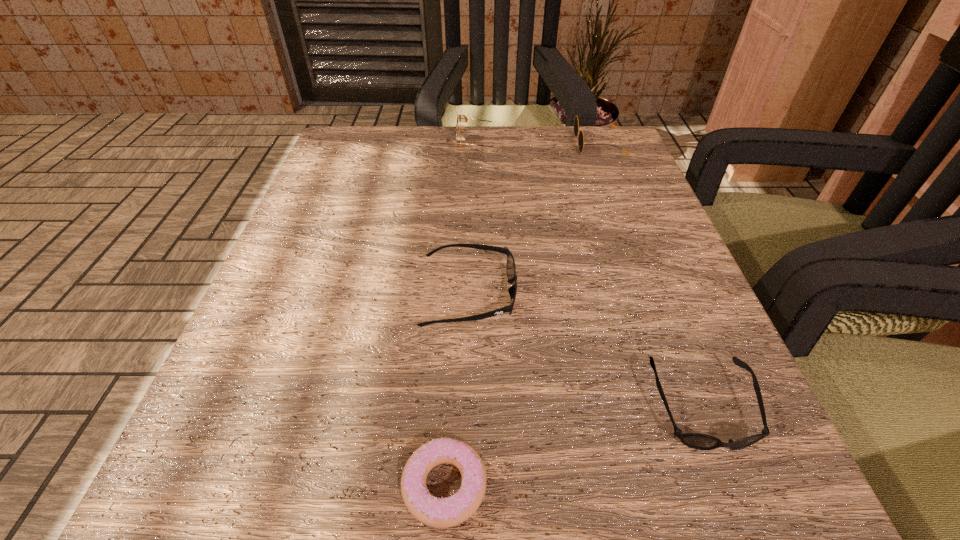
This screenshot has width=960, height=540. In order to click on the tallest object in this screenshot , I will do `click(462, 120)`.

Where is `the third farthest object`? the third farthest object is located at coordinates (510, 267).

At what (x,y) coordinates should I click in order to perform the action: click on the nearest sunglasses. Please return your answer as a coordinate pair (x, y). The width and height of the screenshot is (960, 540). Looking at the image, I should click on 697,441.

Image resolution: width=960 pixels, height=540 pixels. I want to click on doughnut, so click(x=436, y=512).

Locate an element on the screen. free space located 0.090m on the front lenses of the tallest object is located at coordinates (417, 146).

The height and width of the screenshot is (540, 960). I want to click on free region located on the front lenses of the tallest object, so click(356, 146).

Where is `free space located 0.230m on the front lenses of the tallest object`? This screenshot has height=540, width=960. free space located 0.230m on the front lenses of the tallest object is located at coordinates (351, 146).

Find the location of a particular element. This screenshot has height=540, width=960. free space located 0.090m on the front-facing side of the second nearest sunglasses is located at coordinates [577, 294].

Find the location of a particular element. Image resolution: width=960 pixels, height=540 pixels. vacant space located 0.050m on the lenses of the nearest sunglasses is located at coordinates (739, 504).

Locate an element on the screen. This screenshot has width=960, height=540. free space located 0.270m on the back of the doughnut is located at coordinates (456, 273).